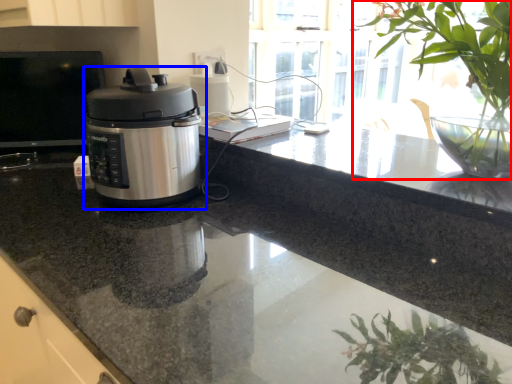
Question: Which object appears closest to the camera in this image, houseplant (highlighted by a red box) or home appliance (highlighted by a blue box)?

Choices:
 (A) houseplant
 (B) home appliance

Answer: (A)